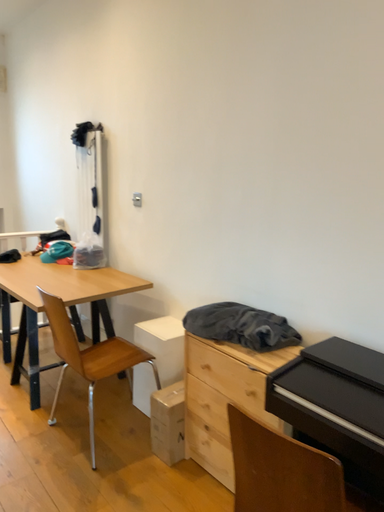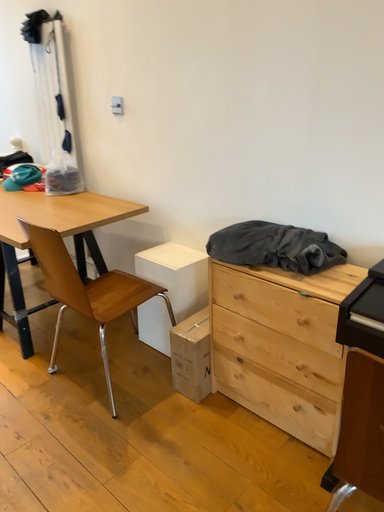
Question: How did the camera likely rotate when shooting the video?

Choices:
 (A) rotated downward
 (B) rotated upward

Answer: (A)